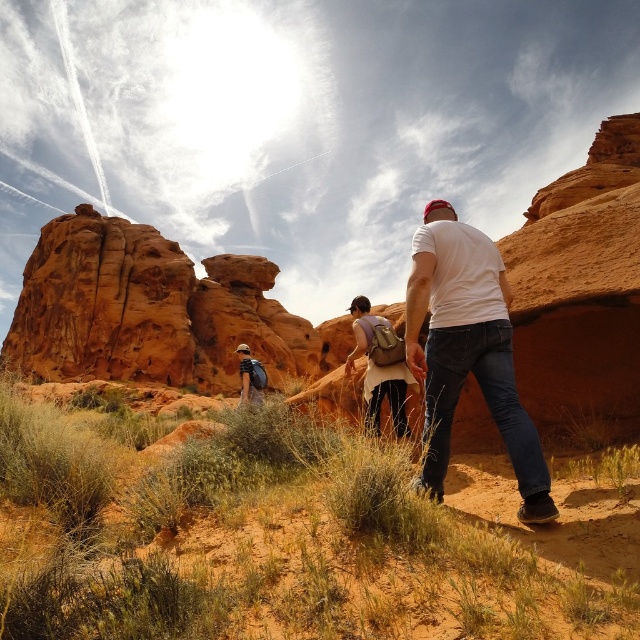
You are a hiker standing at the center of the desert scene. You notice the rustic sandstone rock formation at left and the white matte shirt at center. Which object is positioned further to the east?

The rustic sandstone rock formation at left is positioned further to the east because it is to the left of the white matte shirt at center, and in this scene, left typically corresponds to the eastern direction.

You are a hiker standing at the starting point of the trail. You see the rustic sandstone rock formation at left in the distance. If your GPS says you need to reach it within 20 minutes, and you walk at a steady pace of 3.5 km per hour, will you make it?

The rustic sandstone rock formation at left is 110.26 meters away. Walking at 3.5 km per hour, you can cover 110.26 meters in approximately 1.9 minutes. Yes, you will reach it well within the 20 minute timeframe.